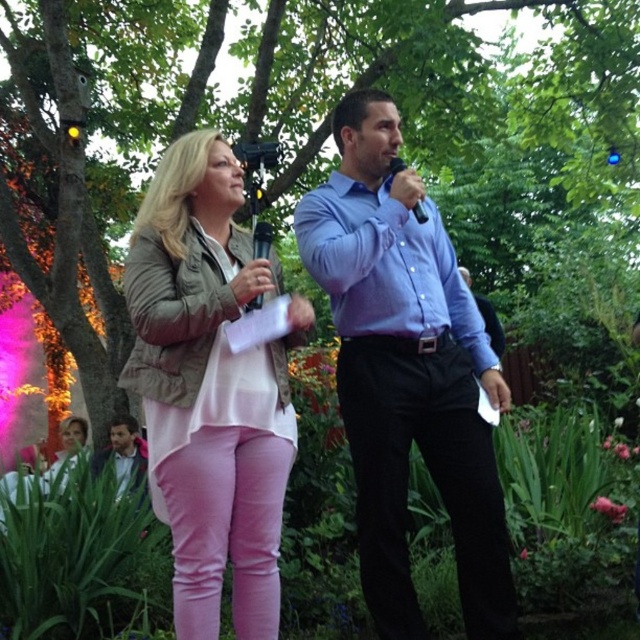
Is light brown leather jacket at lower left to the right of black matte microphone at center from the viewer's perspective?

No, light brown leather jacket at lower left is not to the right of black matte microphone at center.

Is light brown leather jacket at lower left above black matte microphone at center?

No.

Is point (96, 467) behind point (420, 212)?

Yes, it is behind point (420, 212).

This screenshot has width=640, height=640. I want to click on light brown leather jacket at lower left, so click(x=124, y=452).

Is blue cotton shirt at center shorter than black plastic microphone at center?

Incorrect, blue cotton shirt at center's height does not fall short of black plastic microphone at center's.

Between point (355, 474) and point (269, 234), which one is positioned in front?

Positioned in front is point (269, 234).

Identify the location of blue cotton shirt at center. This screenshot has height=640, width=640. (406, 372).

From the picture: Does black plastic microphone at center have a greater width compared to black matte microphone at center?

In fact, black plastic microphone at center might be narrower than black matte microphone at center.

Is black plastic microphone at center thinner than black matte microphone at center?

Correct, black plastic microphone at center's width is less than black matte microphone at center's.

The width and height of the screenshot is (640, 640). I want to click on black plastic microphone at center, so click(x=260, y=240).